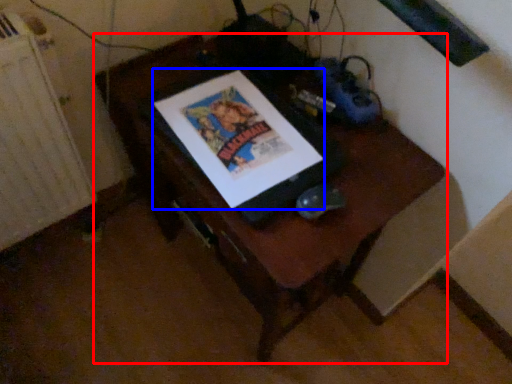
Question: Among these objects, which one is farthest to the camera, furniture (highlighted by a red box) or comic book (highlighted by a blue box)?

Choices:
 (A) furniture
 (B) comic book

Answer: (B)